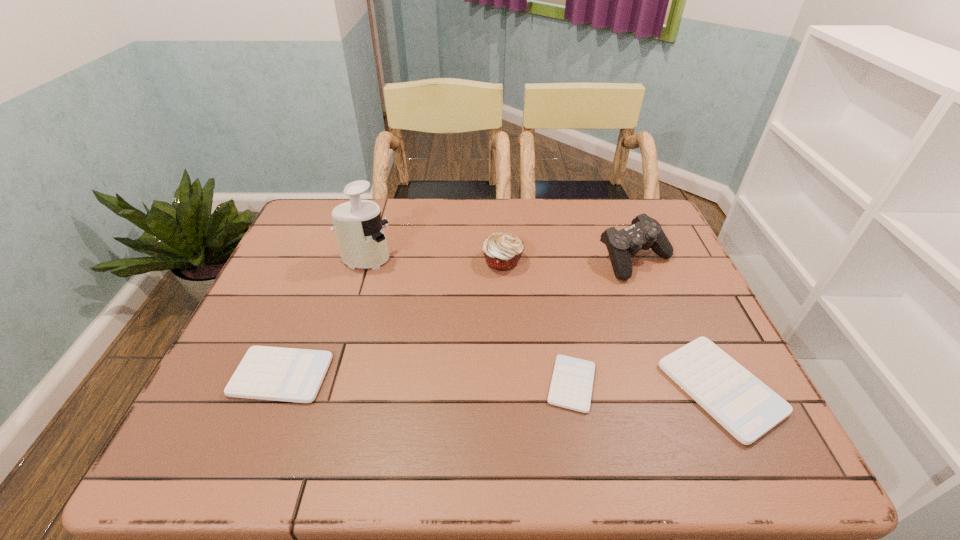
This screenshot has height=540, width=960. Identify the location of vacant position in the image that satisfies the following two spatial constraints: 1. on the front side of the third object from left to right; 2. on the left side of the juicer. (365, 261).

The width and height of the screenshot is (960, 540). In order to click on free space that satisfies the following two spatial constraints: 1. on the back side of the control; 2. on the left side of the second tallest calculator in this screenshot , I will do `click(328, 260)`.